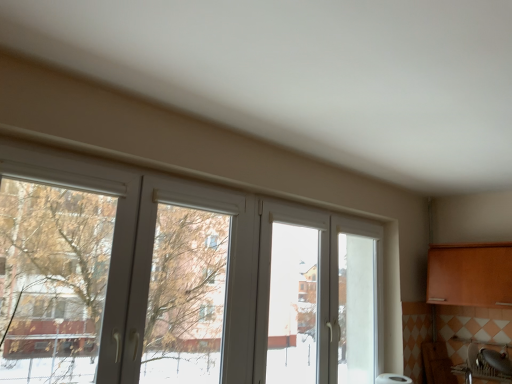
Question: Can you confirm if white plastic window at center is bigger than matte silver sink at lower right?

Choices:
 (A) yes
 (B) no

Answer: (A)

Question: Is white plastic window at center outside of matte silver sink at lower right?

Choices:
 (A) no
 (B) yes

Answer: (B)

Question: Is white plastic window at center aimed at matte silver sink at lower right?

Choices:
 (A) no
 (B) yes

Answer: (A)

Question: From a real-world perspective, is white plastic window at center positioned under matte silver sink at lower right based on gravity?

Choices:
 (A) no
 (B) yes

Answer: (A)

Question: Does white plastic window at center come behind matte silver sink at lower right?

Choices:
 (A) no
 (B) yes

Answer: (A)

Question: Does white plastic window at center have a smaller size compared to matte silver sink at lower right?

Choices:
 (A) yes
 (B) no

Answer: (B)

Question: Are matte silver sink at lower right and white plastic window at center making contact?

Choices:
 (A) yes
 (B) no

Answer: (B)

Question: Does matte silver sink at lower right have a lesser width compared to white plastic window at center?

Choices:
 (A) no
 (B) yes

Answer: (A)

Question: Does matte silver sink at lower right have a greater height compared to white plastic window at center?

Choices:
 (A) no
 (B) yes

Answer: (A)

Question: From a real-world perspective, is matte silver sink at lower right located beneath white plastic window at center?

Choices:
 (A) yes
 (B) no

Answer: (A)

Question: Could you tell me if matte silver sink at lower right is facing white plastic window at center?

Choices:
 (A) yes
 (B) no

Answer: (A)

Question: Does matte silver sink at lower right have a greater width compared to white plastic window at center?

Choices:
 (A) no
 (B) yes

Answer: (B)

Question: In terms of width, does white plastic window at center look wider or thinner when compared to matte silver sink at lower right?

Choices:
 (A) thin
 (B) wide

Answer: (A)